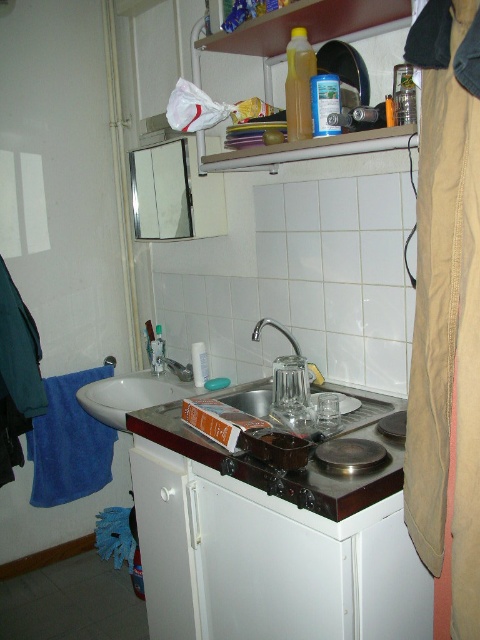
Question: Which point is closer to the camera?

Choices:
 (A) (326, 504)
 (B) (177, 369)
 (C) (291, 385)
 (D) (259, 332)

Answer: (A)

Question: Is brown wooden counter at center to the left of black glass stove at center from the viewer's perspective?

Choices:
 (A) yes
 (B) no

Answer: (A)

Question: Is black glass stove at center below silver metallic faucet at upper center?

Choices:
 (A) no
 (B) yes

Answer: (B)

Question: Which point is closer to the camera taking this photo?

Choices:
 (A) (276, 323)
 (B) (187, 376)
 (C) (264, 486)

Answer: (C)

Question: Which point is closer to the camera taking this photo?

Choices:
 (A) (169, 365)
 (B) (290, 339)
 (C) (391, 449)

Answer: (C)

Question: Does silver metallic faucet at center appear on the left side of brushed metal faucet at sink left?

Choices:
 (A) no
 (B) yes

Answer: (A)